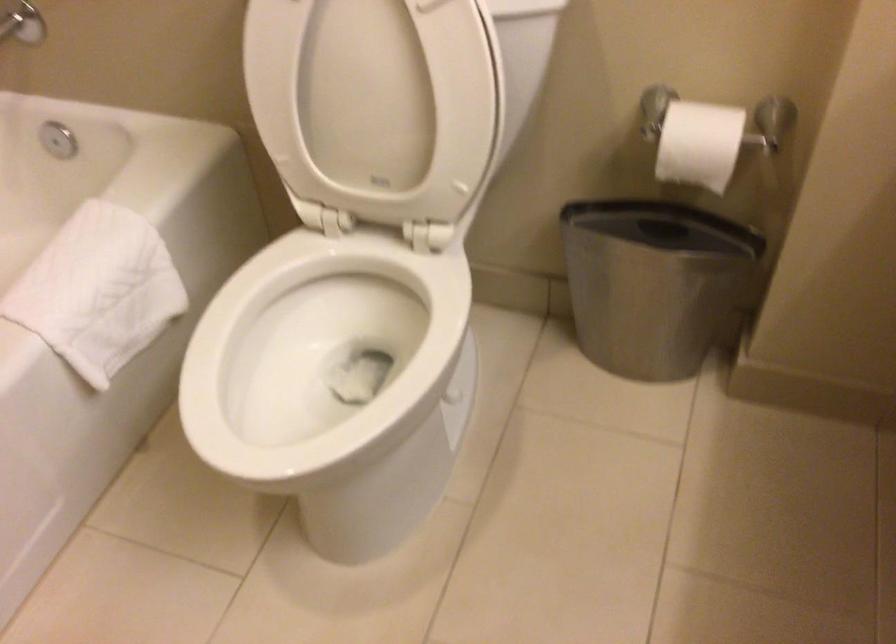
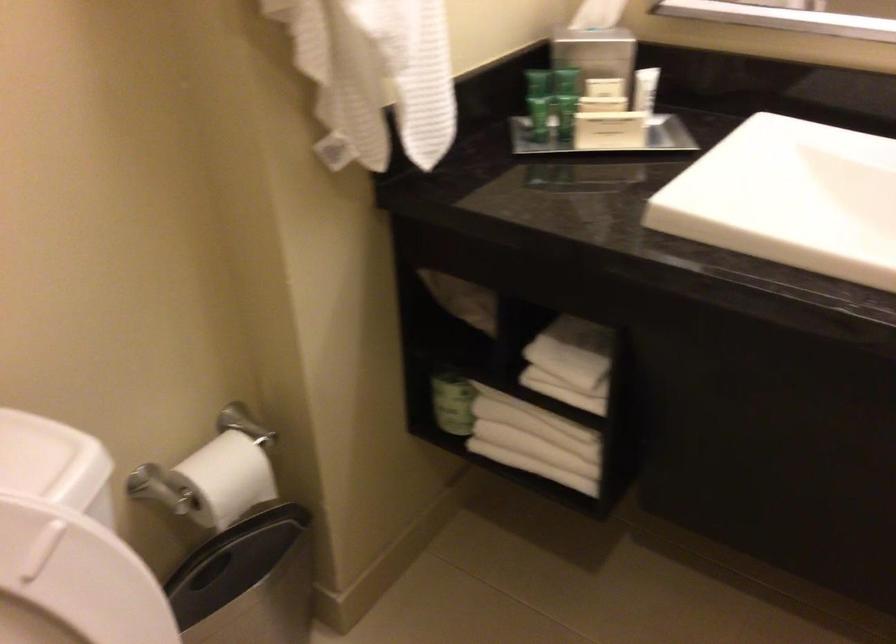
In the second image, find the point that corresponds to [677,125] in the first image.

(211, 480)